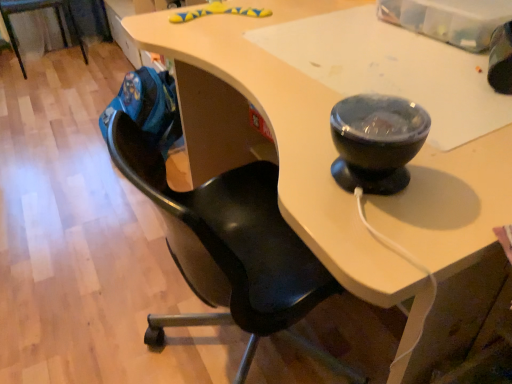
Locate an element on the screen. free space underneath black matte chair at center, which is counted as the 1th chair, starting from the right (from a real-world perspective) is located at coordinates (254, 355).